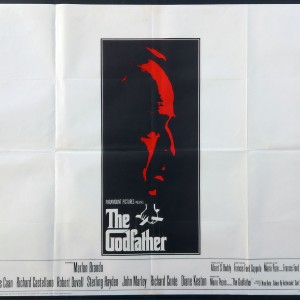
This screenshot has height=300, width=300. What are the coordinates of `blank space around poster` in the screenshot? It's located at [16, 203], [21, 77], [267, 51], [271, 237], [274, 128].